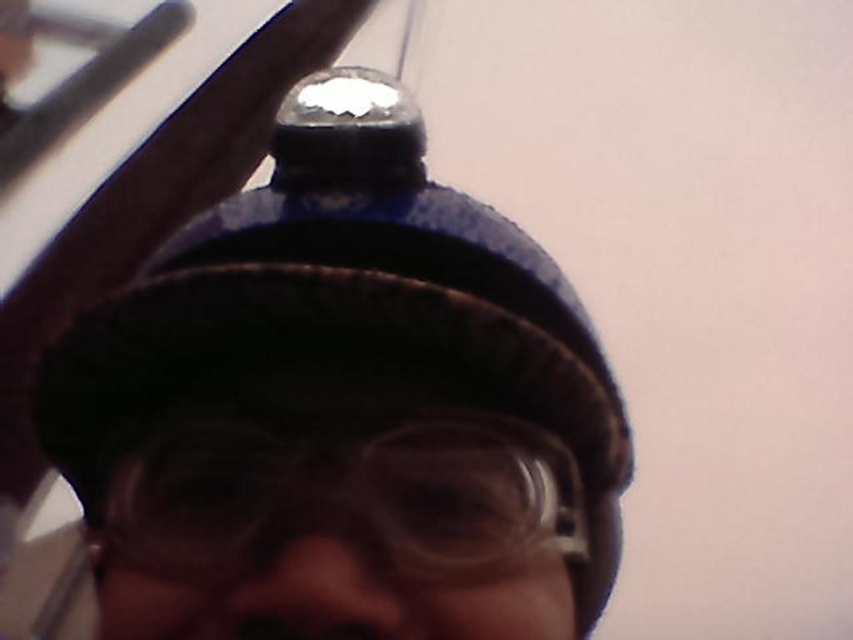
Question: Which object appears closest to the camera in this image?

Choices:
 (A) blue fabric cap at center
 (B) transparent plastic goggles at center

Answer: (B)

Question: Is blue fabric cap at center below transparent plastic goggles at center?

Choices:
 (A) yes
 (B) no

Answer: (B)

Question: Is blue fabric cap at center closer to camera compared to transparent plastic goggles at center?

Choices:
 (A) yes
 (B) no

Answer: (B)

Question: Which object appears closest to the camera in this image?

Choices:
 (A) transparent plastic goggles at center
 (B) blue fabric cap at center

Answer: (A)

Question: Can you confirm if blue fabric cap at center is thinner than transparent plastic goggles at center?

Choices:
 (A) yes
 (B) no

Answer: (B)